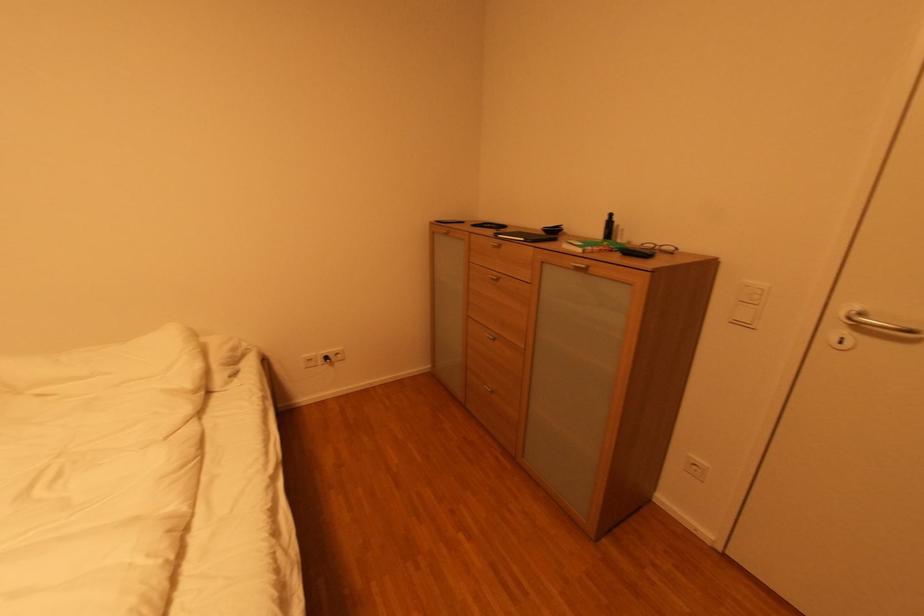
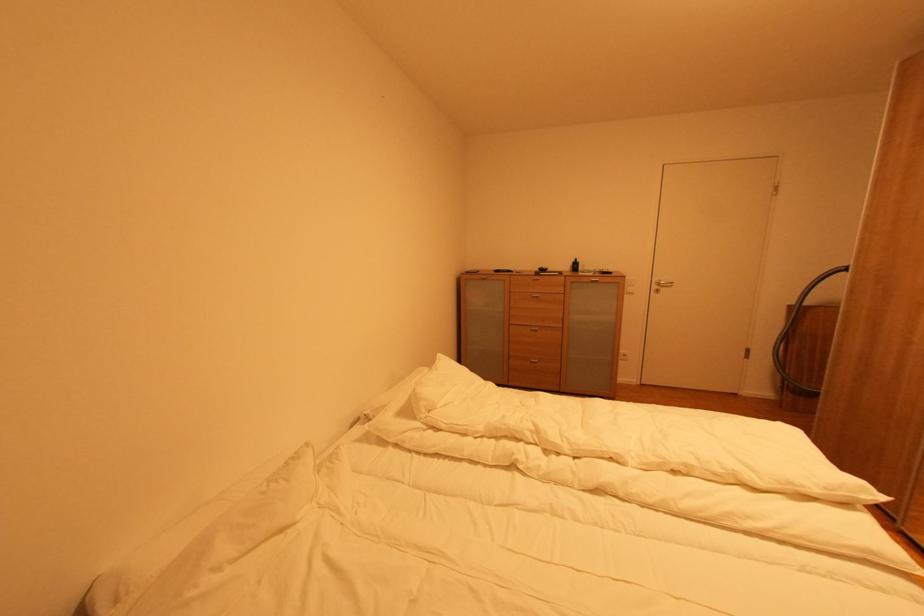
Find the pixel in the second image that matches point 494,339 in the first image.

(539, 331)